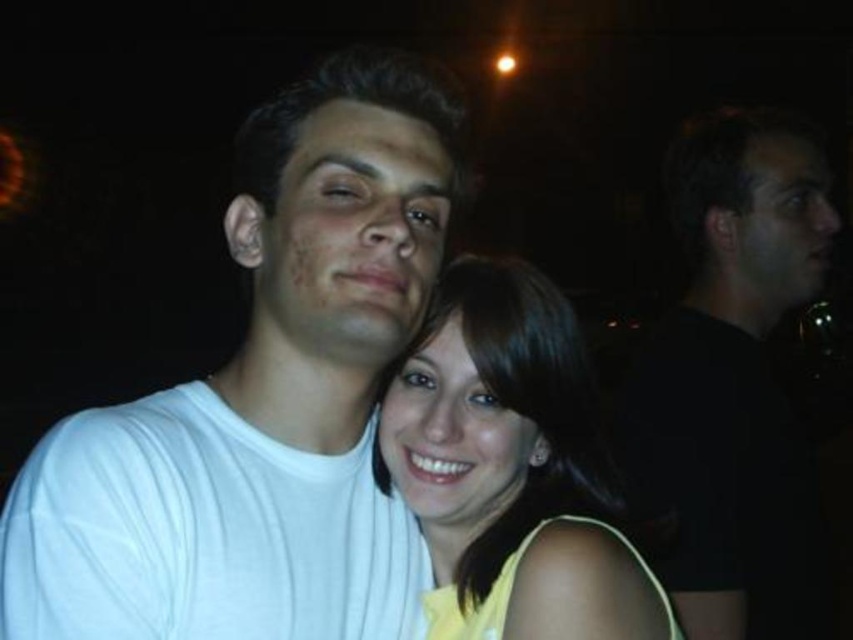
You are at a party and want to know the position of the black matte shirt at right and the yellow matte dress at center. Which one is located to the right side?

The black matte shirt at right is to the right of the yellow matte dress at center.